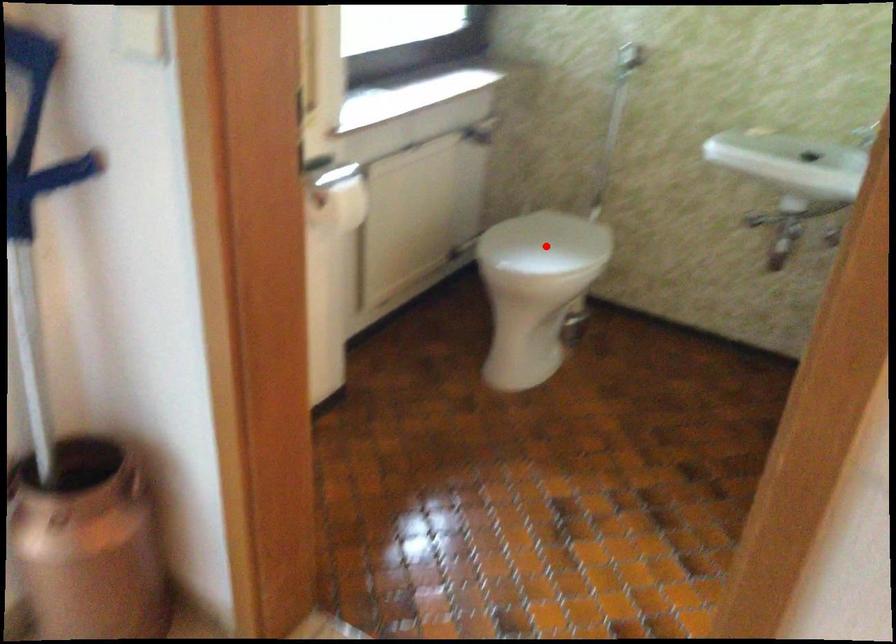
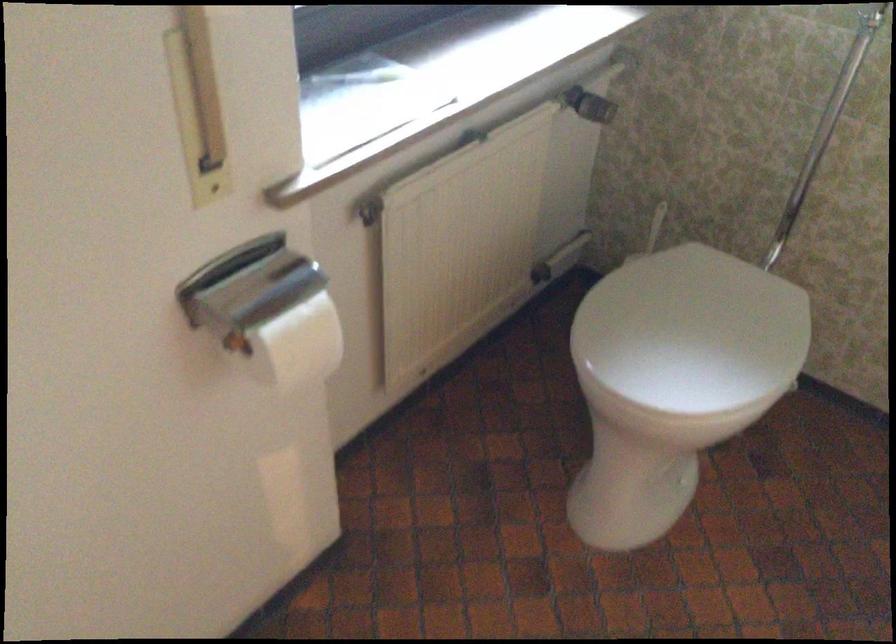
Question: I am providing you with two images of the same scene from different viewpoints. Given a red point in image1, look at the same physical point in image2. Is it:

Choices:
 (A) Closer to the viewpoint
 (B) Farther from the viewpoint

Answer: (A)